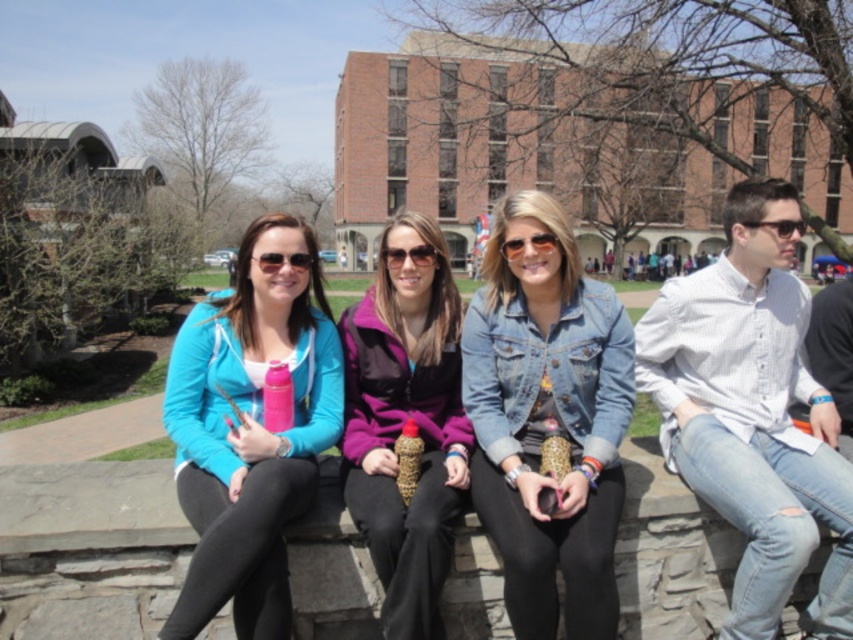
Does purple fleece jacket at center have a smaller size compared to matte black sunglasses at center?

No.

This screenshot has width=853, height=640. Describe the element at coordinates (403, 422) in the screenshot. I see `purple fleece jacket at center` at that location.

Is point (381, 397) positioned in front of point (306, 252)?

No, (381, 397) is further to viewer.

I want to click on purple fleece jacket at center, so click(x=403, y=422).

Measure the distance between purple fleece jacket at center and camera.

27.59 feet

Does purple fleece jacket at center have a greater width compared to black plastic sunglasses at right?

Yes, purple fleece jacket at center is wider than black plastic sunglasses at right.

Between point (451, 388) and point (796, 228), which one is positioned in front?

Point (796, 228) is in front.

You are a GUI agent. You are given a task and a screenshot of the screen. Output one action in this format:
    pyautogui.click(x=<x>, y=<y>)
    Task: Click on the purple fleece jacket at center
    The image size is (853, 640).
    Given the screenshot: What is the action you would take?
    pyautogui.click(x=403, y=422)

Does matte black sunglasses at center appear under black plastic sunglasses at right?

Yes, matte black sunglasses at center is below black plastic sunglasses at right.

Is matte black sunglasses at center smaller than black plastic sunglasses at right?

Yes.

Identify the location of matte black sunglasses at center. (283, 260).

You are a GUI agent. You are given a task and a screenshot of the screen. Output one action in this format:
    pyautogui.click(x=<x>, y=<y>)
    Task: Click on the matte black sunglasses at center
    The height and width of the screenshot is (640, 853).
    Given the screenshot: What is the action you would take?
    pyautogui.click(x=283, y=260)